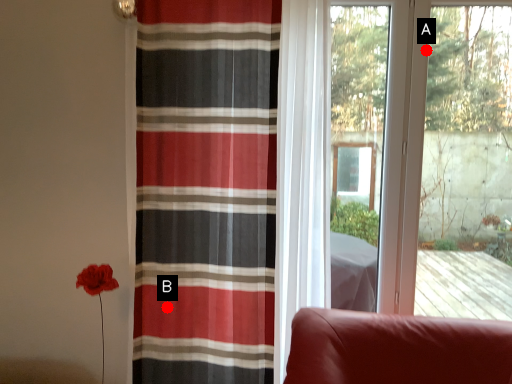
Question: Two points are circled on the image, labeled by A and B beside each circle. Among these points, which one is nearest to the camera?

Choices:
 (A) A is closer
 (B) B is closer

Answer: (B)